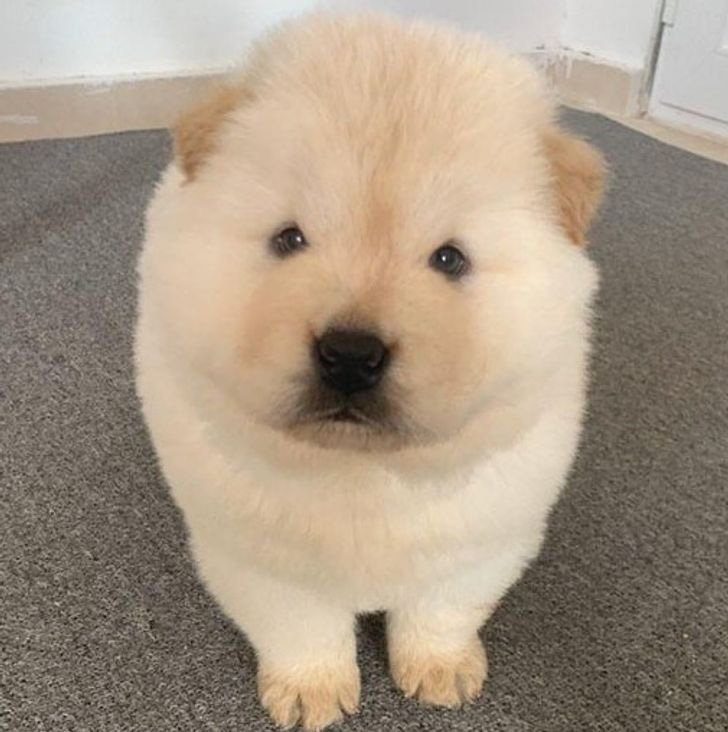
The height and width of the screenshot is (732, 728). I want to click on white wall, so click(114, 45).